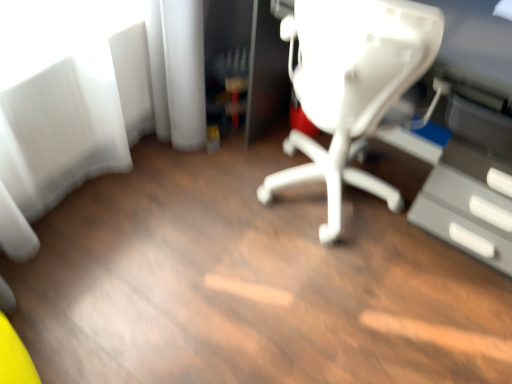
This screenshot has width=512, height=384. I want to click on free spot in front of white plastic chair at center, so click(335, 297).